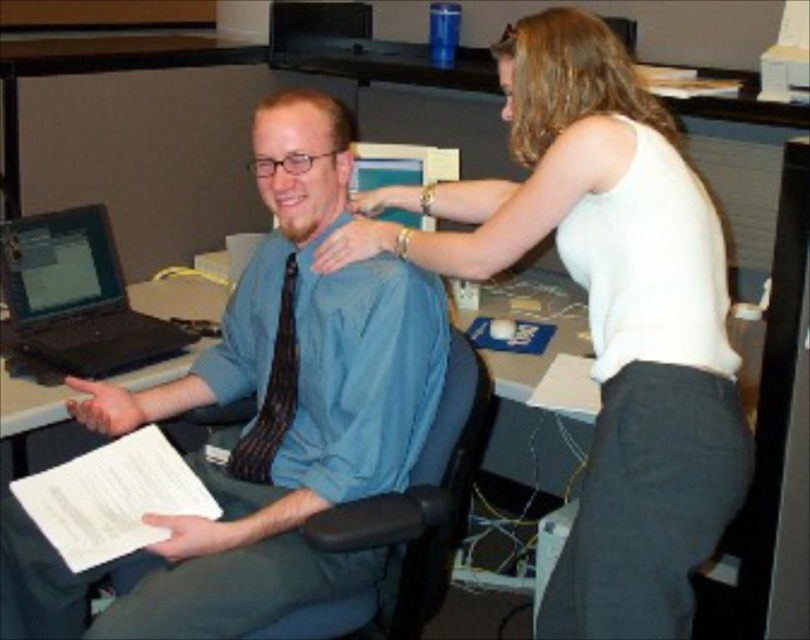
Question: Which object is farther from the camera taking this photo?

Choices:
 (A) black matte laptop at left
 (B) black plastic laptop at left
 (C) white fabric shirt at upper right

Answer: (A)

Question: Which point is closer to the camera taking this photo?

Choices:
 (A) (273, 516)
 (B) (612, 428)
 (C) (147, 376)
 (D) (48, 289)

Answer: (B)

Question: Considering the relative positions of black plastic laptop at left and striped fabric tie at center in the image provided, where is black plastic laptop at left located with respect to striped fabric tie at center?

Choices:
 (A) right
 (B) left

Answer: (B)

Question: In this image, where is black plastic laptop at left located relative to striped fabric tie at center?

Choices:
 (A) right
 (B) left

Answer: (B)

Question: Can you confirm if white fabric shirt at upper right is wider than striped fabric tie at center?

Choices:
 (A) no
 (B) yes

Answer: (B)

Question: Which object appears farthest from the camera in this image?

Choices:
 (A) blue shirt at center
 (B) striped fabric tie at center

Answer: (B)